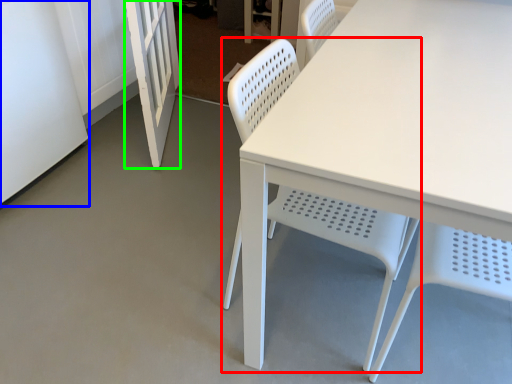
Question: Which is farther away from chair (highlighted by a red box)? screen door (highlighted by a blue box) or screen door (highlighted by a green box)?

Choices:
 (A) screen door
 (B) screen door

Answer: (A)